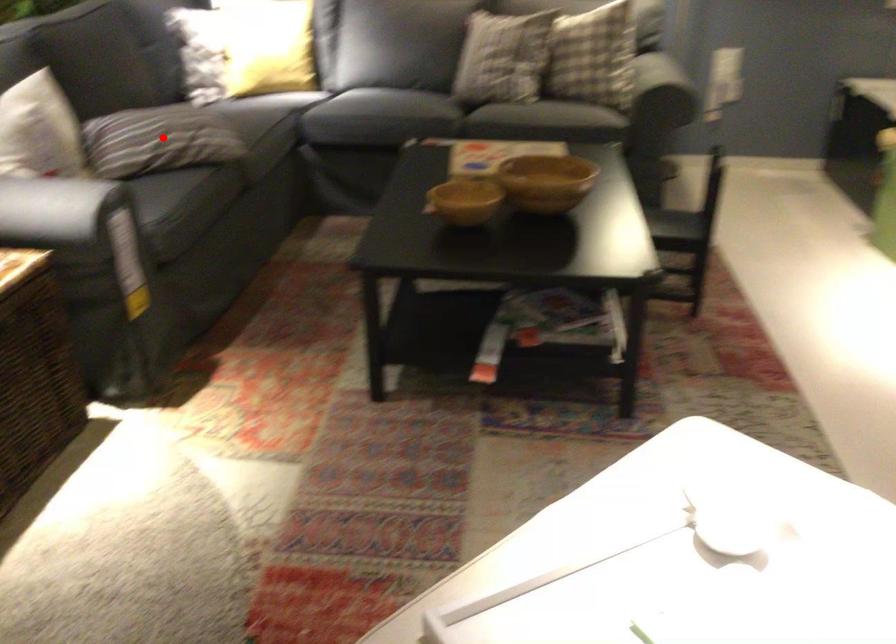
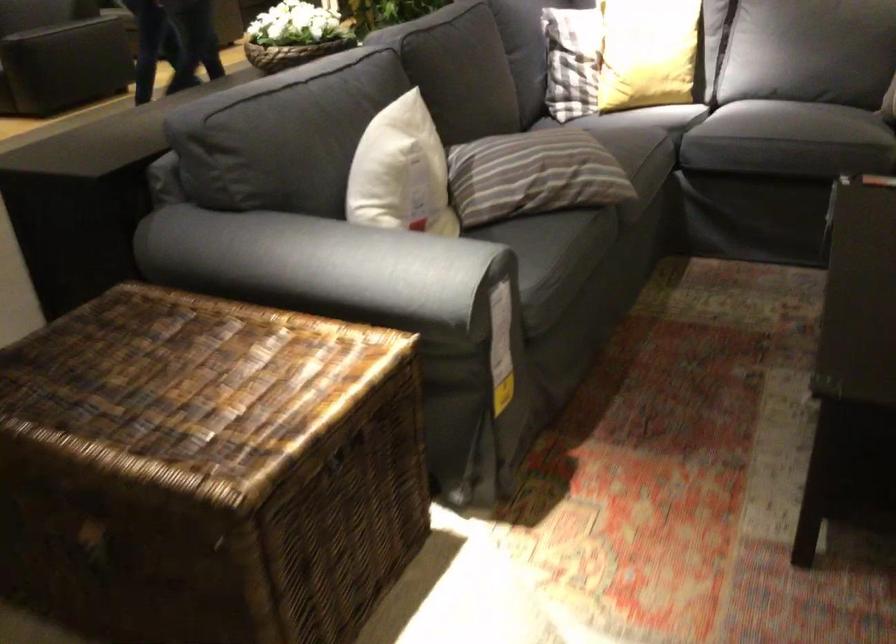
Question: A red point is marked in image1. In image2, is the corresponding 3D point closer to the camera or farther? Reply with the corresponding letter.

Choices:
 (A) The corresponding 3D point is closer.
 (B) The corresponding 3D point is farther.

Answer: (A)